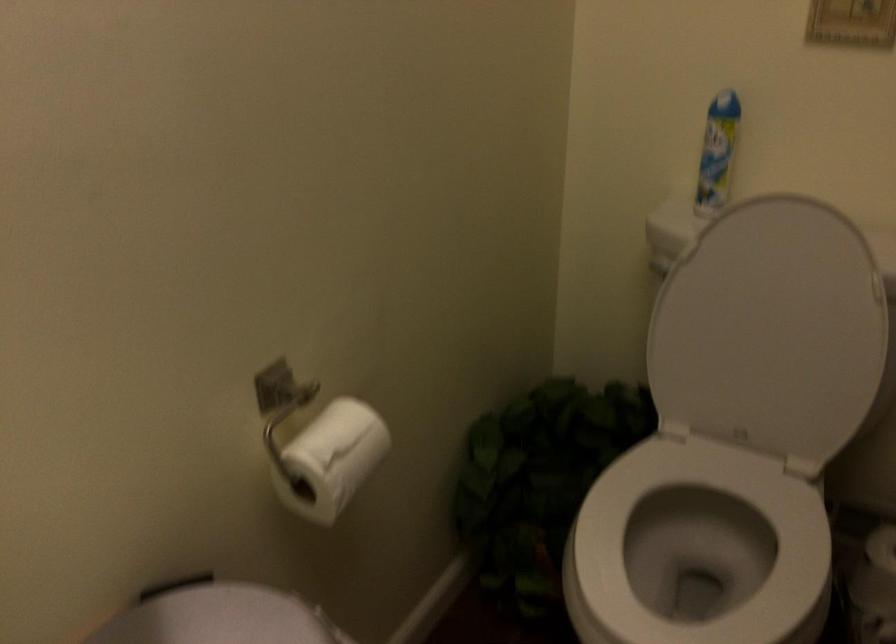
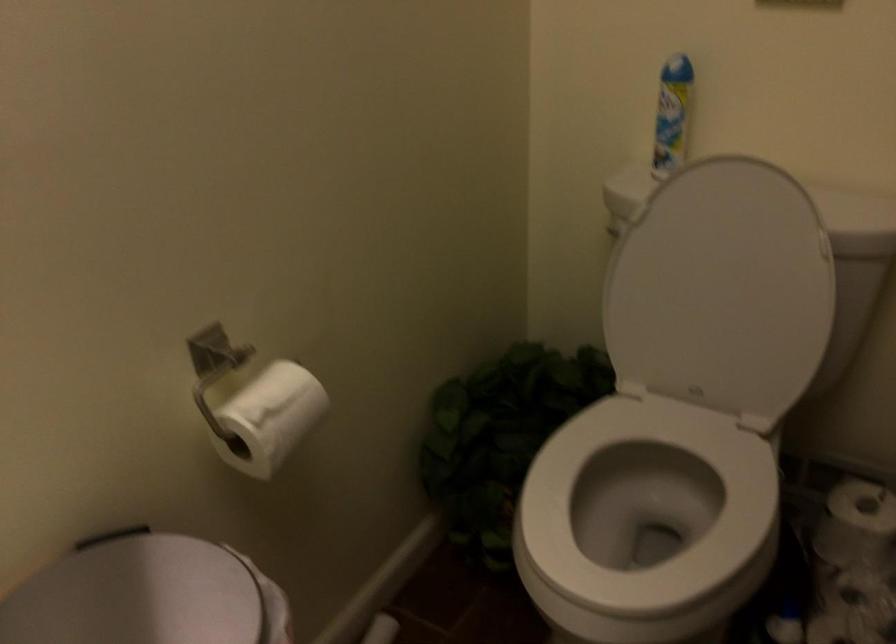
Question: In a continuous first-person perspective shot, in which direction is the camera moving?

Choices:
 (A) Left
 (B) Right
 (C) Forward
 (D) Backward

Answer: (B)